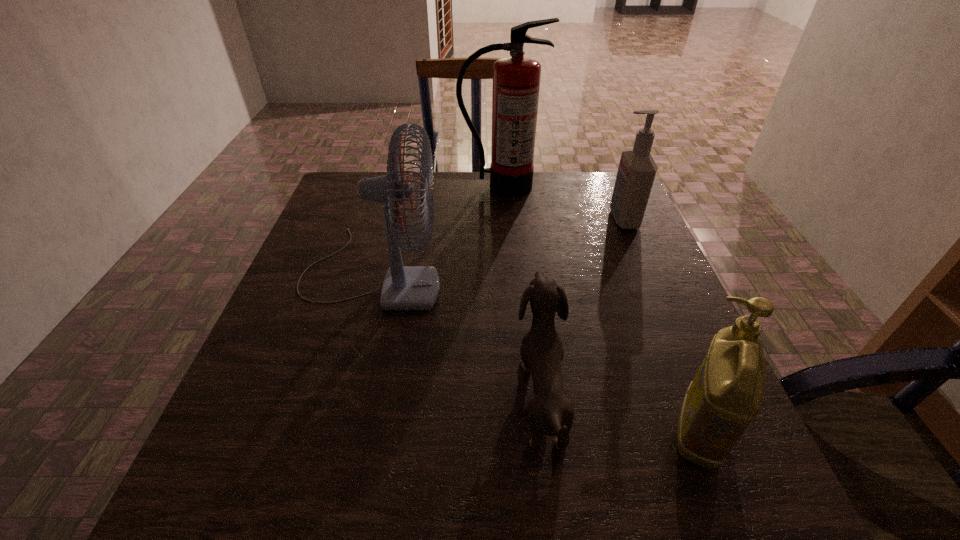
Locate an element on the screen. The image size is (960, 540). object situated at the left edge is located at coordinates (405, 288).

The height and width of the screenshot is (540, 960). I want to click on cleansing agent that is at the right edge, so click(x=637, y=169).

Find the location of a particular element. The image size is (960, 540). detergent located in the right edge section of the desktop is located at coordinates (726, 394).

Where is `object at the far right corner`? object at the far right corner is located at coordinates (637, 169).

At what (x,y) coordinates should I click in order to perform the action: click on object at the near right corner. Please return your answer as a coordinate pair (x, y). This screenshot has width=960, height=540. Looking at the image, I should click on (726, 394).

The height and width of the screenshot is (540, 960). In the image, there is a desktop. Find the location of `vacant space at the far edge`. vacant space at the far edge is located at coordinates (464, 176).

You are a GUI agent. You are given a task and a screenshot of the screen. Output one action in this format:
    pyautogui.click(x=<x>, y=<y>)
    Task: Click on the vacant region at the left edge of the desktop
    This screenshot has height=540, width=960.
    Given the screenshot: What is the action you would take?
    pyautogui.click(x=283, y=380)

Locate an element on the screen. vacant space at the right edge of the desktop is located at coordinates (644, 427).

This screenshot has width=960, height=540. I want to click on free point between the cleansing agent and the second shortest object, so (660, 325).

Locate an element on the screen. vacant space in between the tallest object and the cleansing agent is located at coordinates (562, 202).